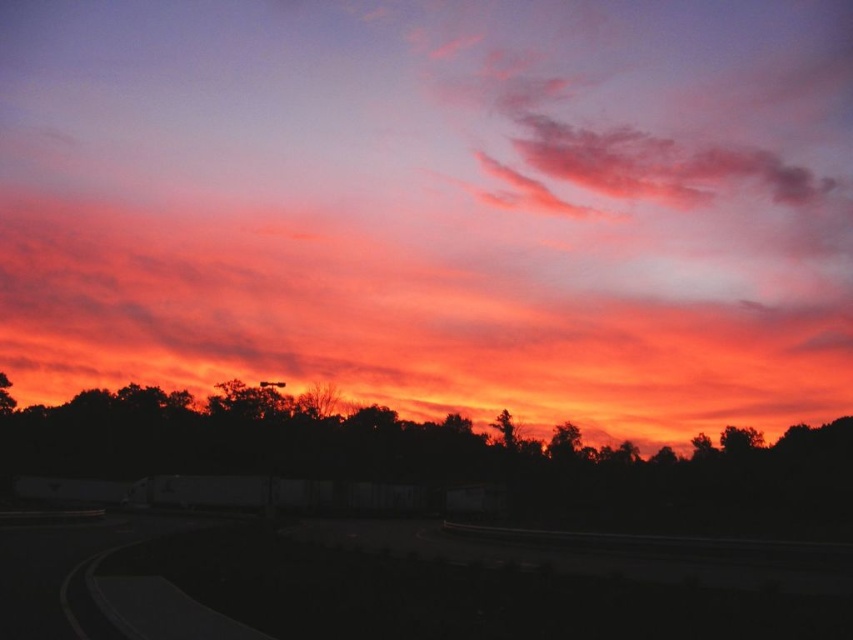
You are standing at the curved road in the foreground of the sunset scene. You see two points labeled as point (x=67, y=556) and point (x=367, y=406). Which point is nearer to you?

Point (x=67, y=556) is closer to the camera than point (x=367, y=406), so the point nearer to you is point (x=67, y=556).

You are an artist trying to paint the sunset scene. You notice two trees at the center of the horizon. The silhouette tree at center and the green leafy tree at center. Which tree do you think has a larger width when viewed from your current position?

The silhouette tree at center might be wider than green leafy tree at center.